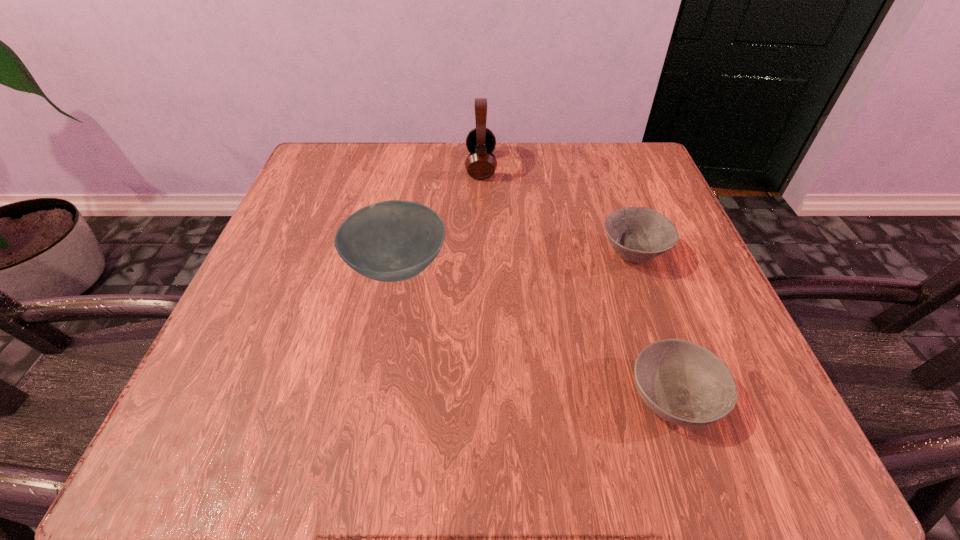
You are a GUI agent. You are given a task and a screenshot of the screen. Output one action in this format:
    pyautogui.click(x=<x>, y=<y>)
    Task: Click on the blank region between the second shortest object and the shortest bowl
    This screenshot has height=540, width=960.
    Given the screenshot: What is the action you would take?
    pyautogui.click(x=654, y=326)

Where is `empty space that is in between the nearest bowl and the second shortest bowl`? The image size is (960, 540). empty space that is in between the nearest bowl and the second shortest bowl is located at coordinates (654, 326).

In order to click on unoccupied position between the tallest bowl and the second shortest object in this screenshot , I will do (515, 261).

Identify which object is the third nearest to the leftmost bowl. Please provide its 2D coordinates. Your answer should be formatted as a tuple, i.e. [(x, y)], where the tuple contains the x and y coordinates of a point satisfying the conditions above.

[(682, 382)]

Identify which object is the second closest to the leftmost object. Please provide its 2D coordinates. Your answer should be formatted as a tuple, i.e. [(x, y)], where the tuple contains the x and y coordinates of a point satisfying the conditions above.

[(637, 234)]

The width and height of the screenshot is (960, 540). Identify the location of the closest bowl relative to the second tallest bowl. (682, 382).

The width and height of the screenshot is (960, 540). Find the location of `bowl that is the second closest to the third tallest object`. bowl that is the second closest to the third tallest object is located at coordinates (389, 241).

This screenshot has width=960, height=540. Identify the location of vacant space that satisfies the following two spatial constraints: 1. on the ear pads of the tallest object; 2. on the left side of the second shortest object. (481, 255).

Locate an element on the screen. The width and height of the screenshot is (960, 540). vacant space that satisfies the following two spatial constraints: 1. on the ear pads of the tallest object; 2. on the back side of the shortest object is located at coordinates (482, 396).

The width and height of the screenshot is (960, 540). Find the location of `free space that satisfies the following two spatial constraints: 1. on the back side of the second shortest bowl; 2. on the left side of the tallest bowl`. free space that satisfies the following two spatial constraints: 1. on the back side of the second shortest bowl; 2. on the left side of the tallest bowl is located at coordinates (398, 255).